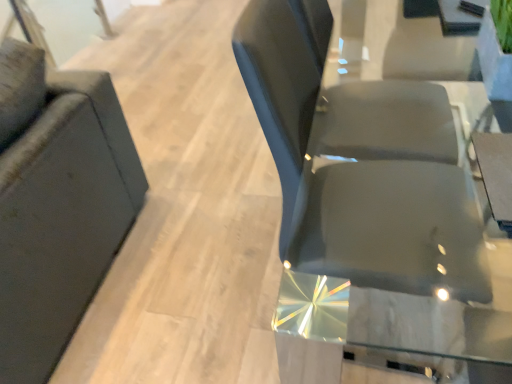
Question: Considering the relative positions of transparent glass door at upper left and matte black chair at left, which appears as the 2th chair when viewed from the right, in the image provided, is transparent glass door at upper left to the right of matte black chair at left, which appears as the 2th chair when viewed from the right, from the viewer's perspective?

Choices:
 (A) no
 (B) yes

Answer: (A)

Question: From the image's perspective, is transparent glass door at upper left located beneath matte black chair at left, which is counted as the first chair, starting from the left?

Choices:
 (A) no
 (B) yes

Answer: (A)

Question: Is transparent glass door at upper left not near matte black chair at left, which is counted as the first chair, starting from the left?

Choices:
 (A) yes
 (B) no

Answer: (A)

Question: Is transparent glass door at upper left further to the viewer compared to matte black chair at left, which appears as the 2th chair when viewed from the right?

Choices:
 (A) yes
 (B) no

Answer: (A)

Question: Is transparent glass door at upper left taller than matte black chair at left, which appears as the 2th chair when viewed from the right?

Choices:
 (A) no
 (B) yes

Answer: (A)

Question: Is transparent glass door at upper left touching matte black chair at left, which appears as the 2th chair when viewed from the right?

Choices:
 (A) yes
 (B) no

Answer: (B)

Question: Can you confirm if glossy black chair at center, acting as the 2th chair starting from the left, is taller than transparent glass door at upper left?

Choices:
 (A) yes
 (B) no

Answer: (A)

Question: Could you tell me if glossy black chair at center, acting as the 2th chair starting from the left, is facing transparent glass door at upper left?

Choices:
 (A) no
 (B) yes

Answer: (A)

Question: From a real-world perspective, is glossy black chair at center, acting as the 2th chair starting from the left, physically below transparent glass door at upper left?

Choices:
 (A) yes
 (B) no

Answer: (B)

Question: Considering the relative positions of glossy black chair at center, acting as the 2th chair starting from the left, and transparent glass door at upper left in the image provided, is glossy black chair at center, acting as the 2th chair starting from the left, to the left of transparent glass door at upper left from the viewer's perspective?

Choices:
 (A) no
 (B) yes

Answer: (A)

Question: Does glossy black chair at center, acting as the 2th chair starting from the left, come in front of transparent glass door at upper left?

Choices:
 (A) no
 (B) yes

Answer: (B)

Question: Is transparent glass door at upper left at the back of glossy black chair at center, acting as the 2th chair starting from the left?

Choices:
 (A) yes
 (B) no

Answer: (B)

Question: Is transparent glass door at upper left aimed at glossy black chair at center, marked as the first chair in a right-to-left arrangement?

Choices:
 (A) no
 (B) yes

Answer: (A)